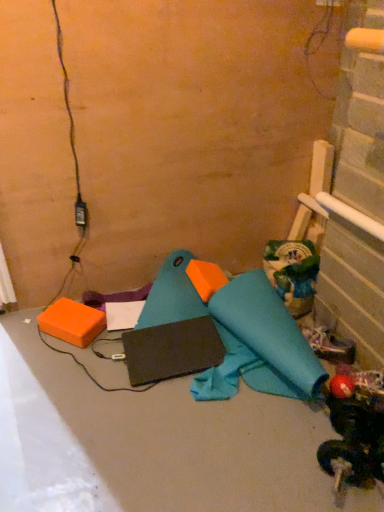
Image resolution: width=384 pixels, height=512 pixels. Identify the location of vacant area to the left of rubberized red ball at lower right, acting as the first toy starting from the front. point(269,452).